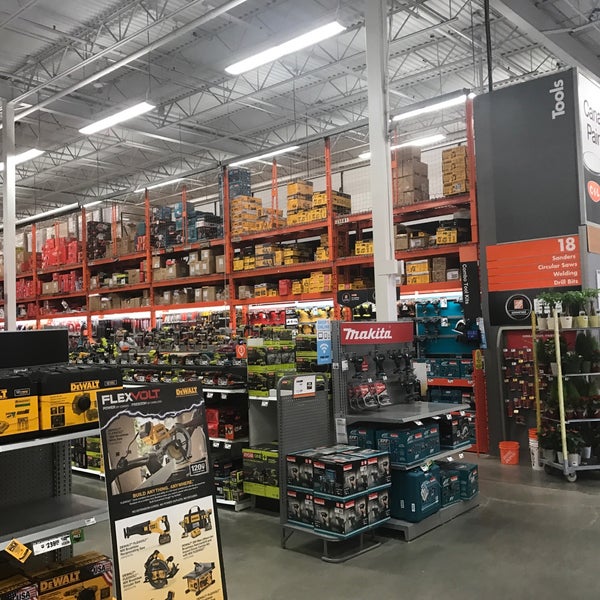
Identify the location of metal shelf/rack. The image size is (600, 600). (309, 442), (389, 419), (345, 403), (289, 525).